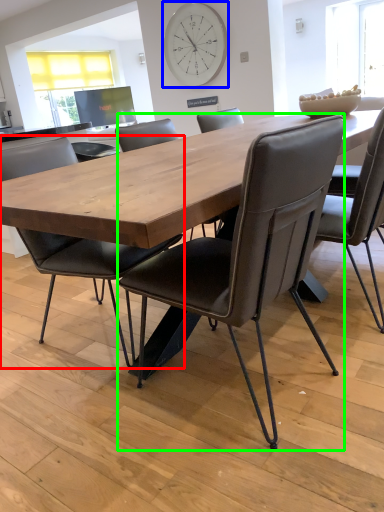
Question: Which object is the closest to the chair (highlighted by a red box)? Choose among these: clock (highlighted by a blue box) or chair (highlighted by a green box).

Choices:
 (A) clock
 (B) chair

Answer: (B)